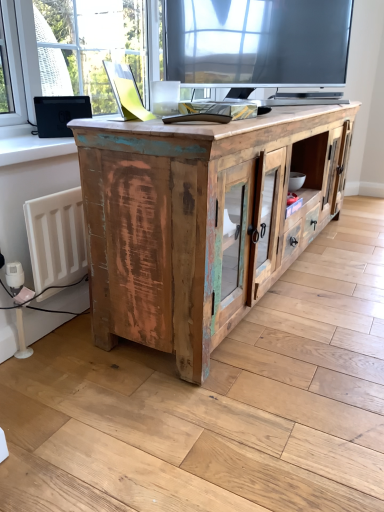
Question: Considering the positions of white painted wood at left and rustic wood cabinet at center in the image, is white painted wood at left wider or thinner than rustic wood cabinet at center?

Choices:
 (A) thin
 (B) wide

Answer: (A)

Question: Is point click(13, 162) closer or farther from the camera than point click(269, 210)?

Choices:
 (A) farther
 (B) closer

Answer: (B)

Question: Considering their positions, is white painted wood at left located in front of or behind rustic wood cabinet at center?

Choices:
 (A) front
 (B) behind

Answer: (B)

Question: Is rustic wood cabinet at center wider or thinner than white painted wood at left?

Choices:
 (A) wide
 (B) thin

Answer: (A)

Question: Considering the positions of rustic wood cabinet at center and white painted wood at left in the image, is rustic wood cabinet at center taller or shorter than white painted wood at left?

Choices:
 (A) tall
 (B) short

Answer: (A)

Question: From a real-world perspective, is rustic wood cabinet at center positioned above or below white painted wood at left?

Choices:
 (A) below
 (B) above

Answer: (A)

Question: Is point (170, 153) closer or farther from the camera than point (41, 156)?

Choices:
 (A) farther
 (B) closer

Answer: (B)